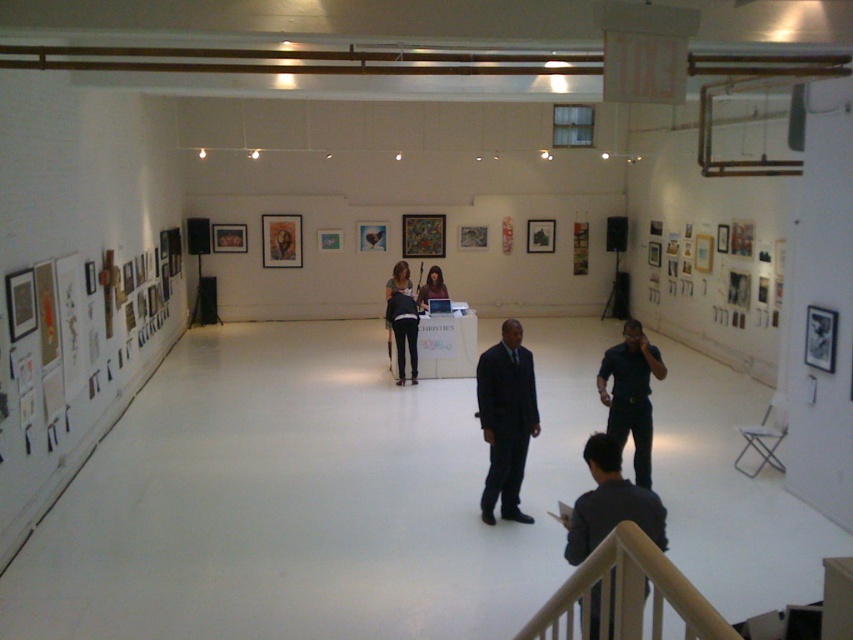
Is matte black jacket at center to the right of matte black laptop at center from the viewer's perspective?

Incorrect, matte black jacket at center is not on the right side of matte black laptop at center.

The image size is (853, 640). What do you see at coordinates (403, 332) in the screenshot? I see `matte black jacket at center` at bounding box center [403, 332].

Where is `matte black jacket at center`? The width and height of the screenshot is (853, 640). matte black jacket at center is located at coordinates (403, 332).

Which is in front, point (636, 448) or point (440, 288)?

Point (636, 448) is in front.

Is point (619, 388) closer to viewer compared to point (431, 266)?

Yes, it is.

Who is more distant from viewer, [619,400] or [426,275]?

Positioned behind is point [426,275].

Locate an element on the screen. The height and width of the screenshot is (640, 853). dark blue shirt at right is located at coordinates (631, 394).

Can you confirm if dark blue shirt at lower center is shorter than matte black laptop at center?

In fact, dark blue shirt at lower center may be taller than matte black laptop at center.

Looking at this image, who is more forward, (x=582, y=500) or (x=440, y=276)?

Positioned in front is point (x=582, y=500).

You are a GUI agent. You are given a task and a screenshot of the screen. Output one action in this format:
    pyautogui.click(x=<x>, y=<y>)
    Task: Click on the dark blue shirt at lower center
    The height and width of the screenshot is (640, 853).
    Given the screenshot: What is the action you would take?
    pyautogui.click(x=608, y=502)